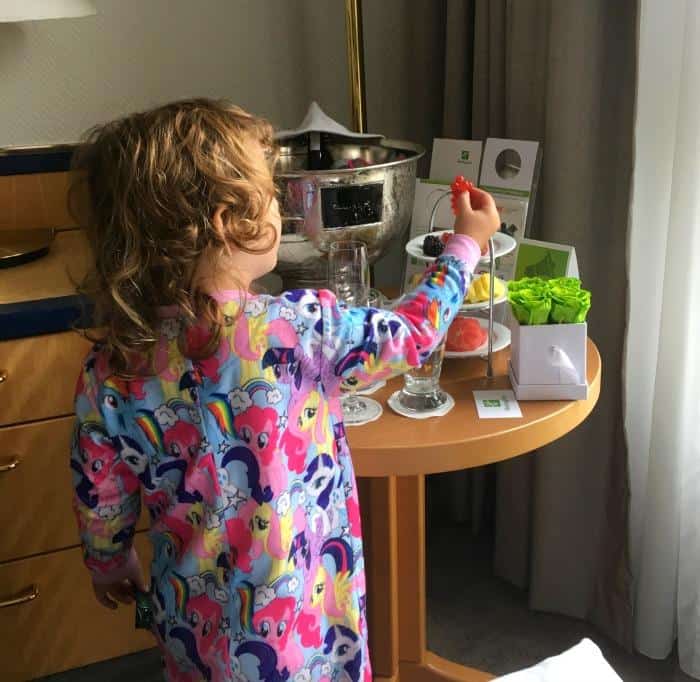
Where is `plates`? The width and height of the screenshot is (700, 682). plates is located at coordinates (500, 256), (502, 295), (500, 337).